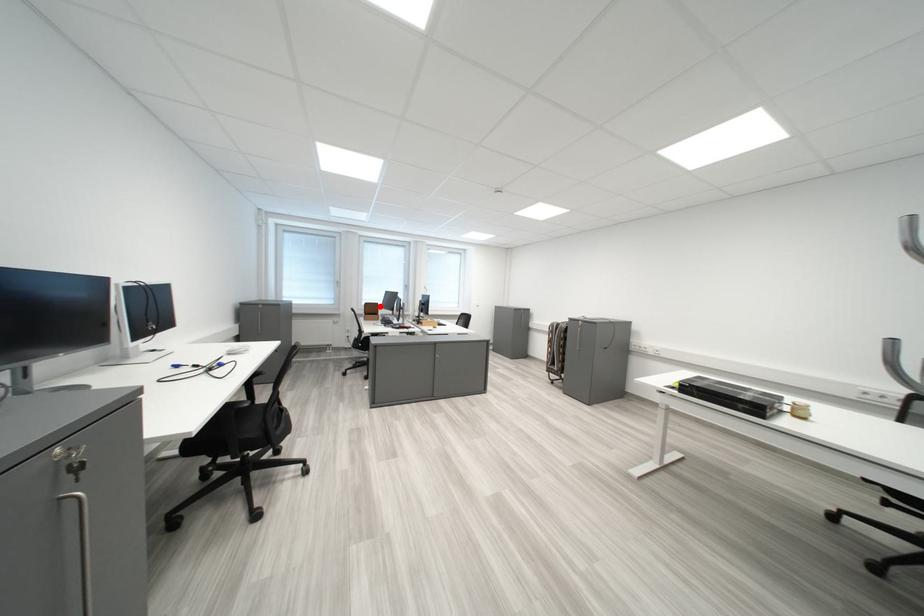
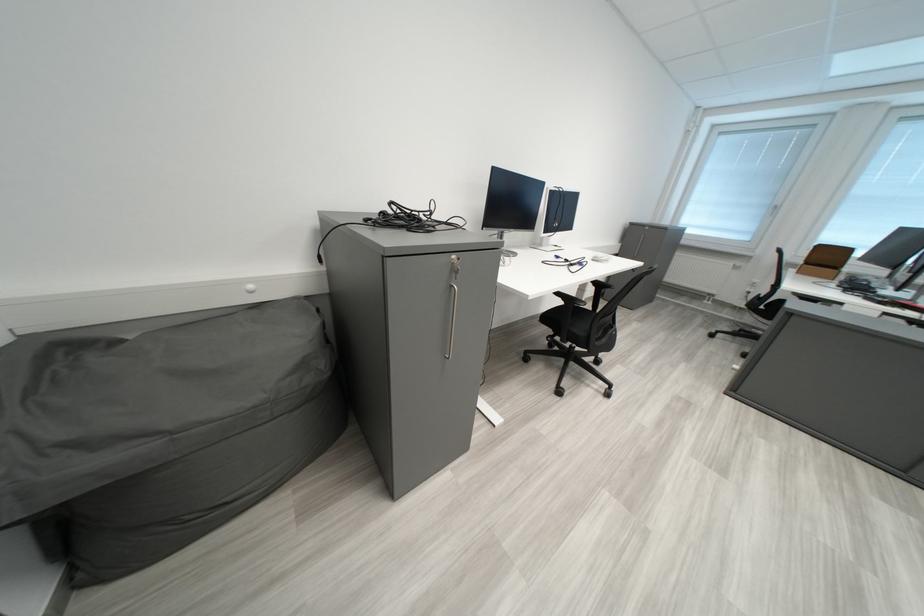
In the second image, find the point that corresponds to the highlighted location in the first image.

(833, 249)